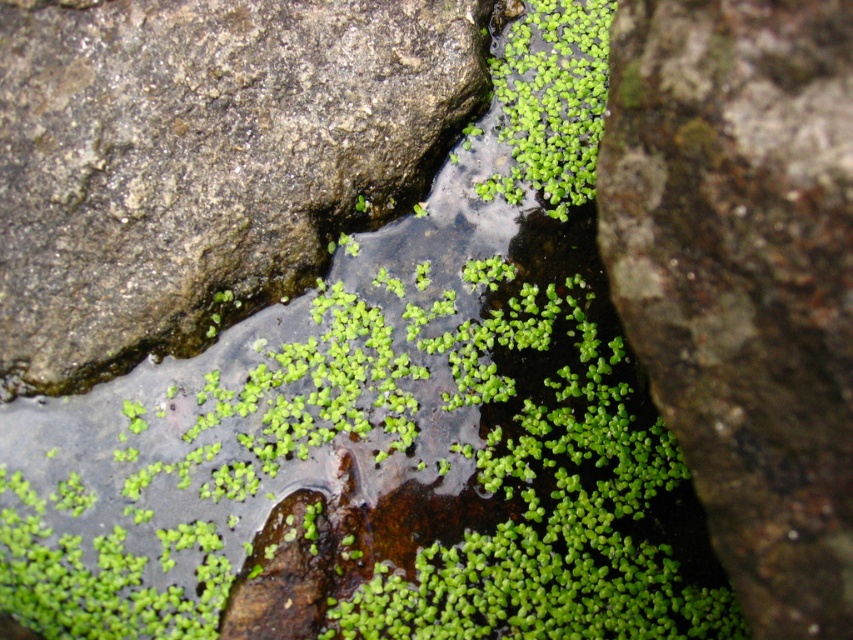
You are a frog sitting at the center of the pool. You see two points in the water, point 1 at point (183, 3) and point 2 at point (801, 477). Which point is closer to you?

Point 1 at point (183, 3) is closer to you because it is further to the viewer than point 2 at point (801, 477), meaning it is nearer in the visual perspective.

You are standing at the edge of the shallow pool and want to step onto the green mossy rock at center. Based on its coordinates, can you determine if it is positioned in the middle of the pool or closer to the edge?

The green mossy rock at center is located at coordinates point (743, 278). Since the coordinates are both less than 0.5, it means the rock is positioned closer to the bottom right edge of the pool rather than being centrally located.